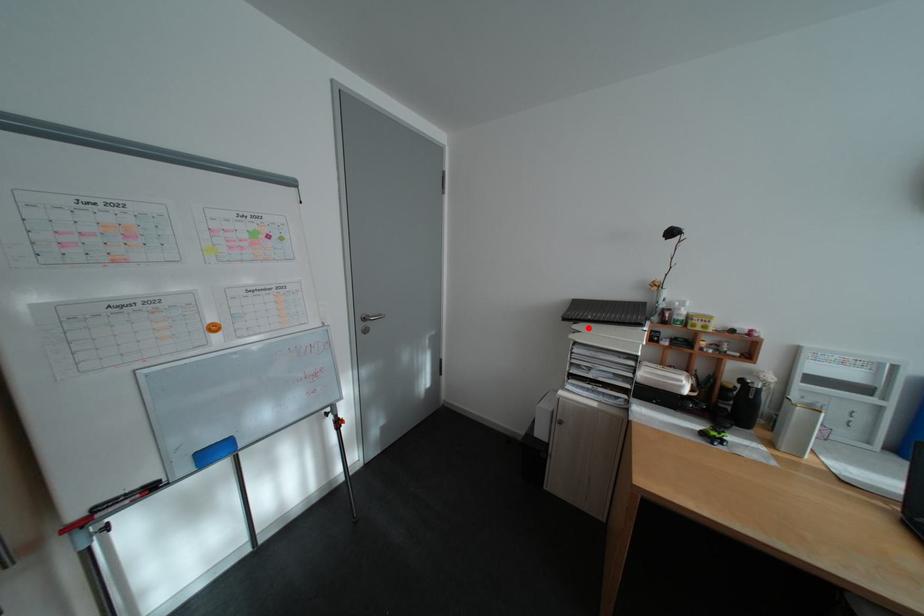
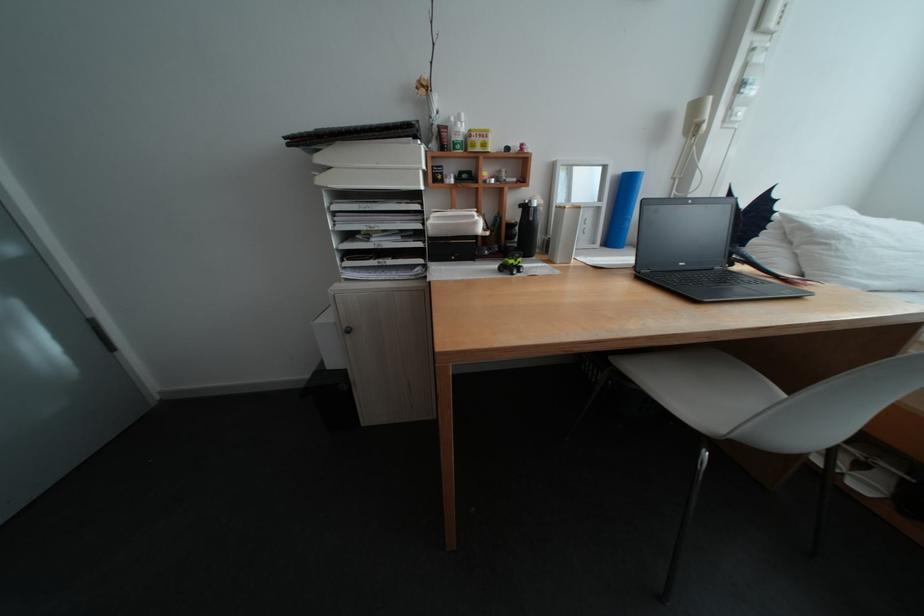
Find the pixel in the second image that matches the highlighted location in the first image.

(333, 160)